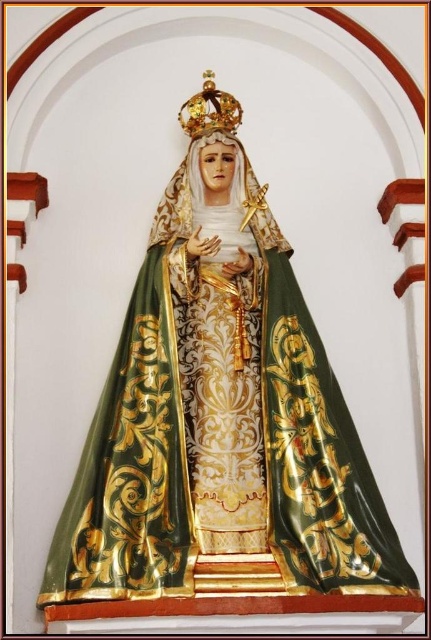
Based on the photo, can you confirm if green satin cape at center is positioned to the right of gold shiny crown at upper center?

Correct, you'll find green satin cape at center to the right of gold shiny crown at upper center.

Between green satin cape at center and gold shiny crown at upper center, which one is positioned higher?

gold shiny crown at upper center is higher up.

Is point (146, 515) positioned in front of point (208, 129)?

Yes, it is.

Locate an element on the screen. green satin cape at center is located at coordinates (219, 417).